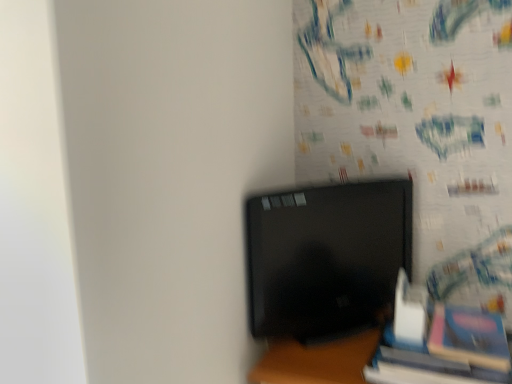
Measure the distance between point (x=254, y=292) and camera.

The depth of point (x=254, y=292) is 90.10 centimeters.

The image size is (512, 384). What do you see at coordinates (325, 257) in the screenshot?
I see `black matte computer monitor at center` at bounding box center [325, 257].

What is the approximate width of black matte computer monitor at center?

It is 4.45 inches.

Locate an element on the screen. Image resolution: width=512 pixels, height=384 pixels. black matte computer monitor at center is located at coordinates (325, 257).

Identify the location of black matte computer monitor at center. (325, 257).